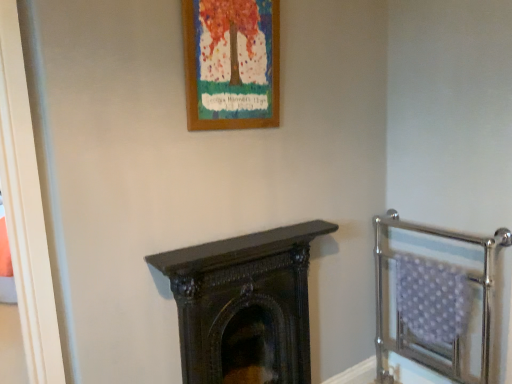
Question: Is wooden frame at upper center closer to the viewer compared to dark wood fireplace at center?

Choices:
 (A) no
 (B) yes

Answer: (B)

Question: Are wooden frame at upper center and dark wood fireplace at center far apart?

Choices:
 (A) no
 (B) yes

Answer: (A)

Question: From the image's perspective, is wooden frame at upper center on top of dark wood fireplace at center?

Choices:
 (A) no
 (B) yes

Answer: (B)

Question: Is wooden frame at upper center not within dark wood fireplace at center?

Choices:
 (A) yes
 (B) no

Answer: (A)

Question: Is wooden frame at upper center to the left of dark wood fireplace at center from the viewer's perspective?

Choices:
 (A) no
 (B) yes

Answer: (B)

Question: Is wooden frame at upper center shorter than dark wood fireplace at center?

Choices:
 (A) yes
 (B) no

Answer: (A)

Question: Does polished chrome balustrade at right have a greater height compared to wooden frame at upper center?

Choices:
 (A) no
 (B) yes

Answer: (B)

Question: From the image's perspective, is polished chrome balustrade at right located beneath wooden frame at upper center?

Choices:
 (A) no
 (B) yes

Answer: (B)

Question: From a real-world perspective, is polished chrome balustrade at right beneath wooden frame at upper center?

Choices:
 (A) no
 (B) yes

Answer: (B)

Question: From a real-world perspective, does polished chrome balustrade at right stand above wooden frame at upper center?

Choices:
 (A) no
 (B) yes

Answer: (A)

Question: Is polished chrome balustrade at right not inside wooden frame at upper center?

Choices:
 (A) yes
 (B) no

Answer: (A)

Question: Considering the relative sizes of polished chrome balustrade at right and wooden frame at upper center in the image provided, is polished chrome balustrade at right wider than wooden frame at upper center?

Choices:
 (A) no
 (B) yes

Answer: (B)

Question: Is the position of polished chrome balustrade at right less distant than that of dark wood fireplace at center?

Choices:
 (A) no
 (B) yes

Answer: (A)